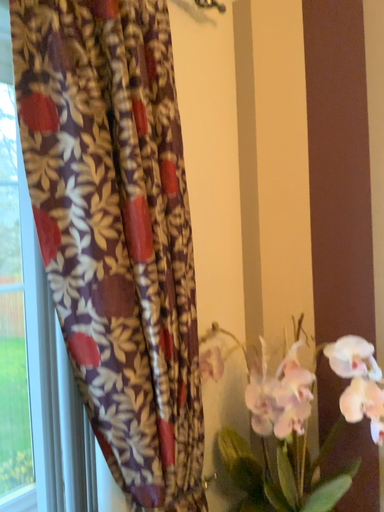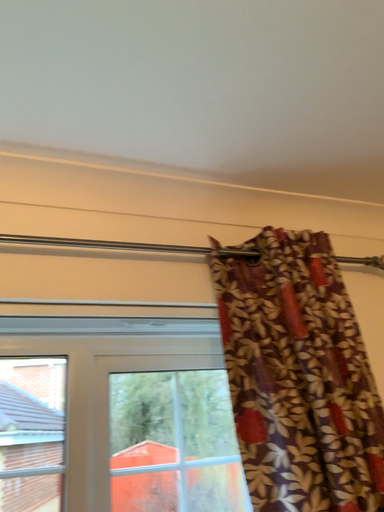
Question: How did the camera likely rotate when shooting the video?

Choices:
 (A) rotated upward
 (B) rotated downward

Answer: (A)